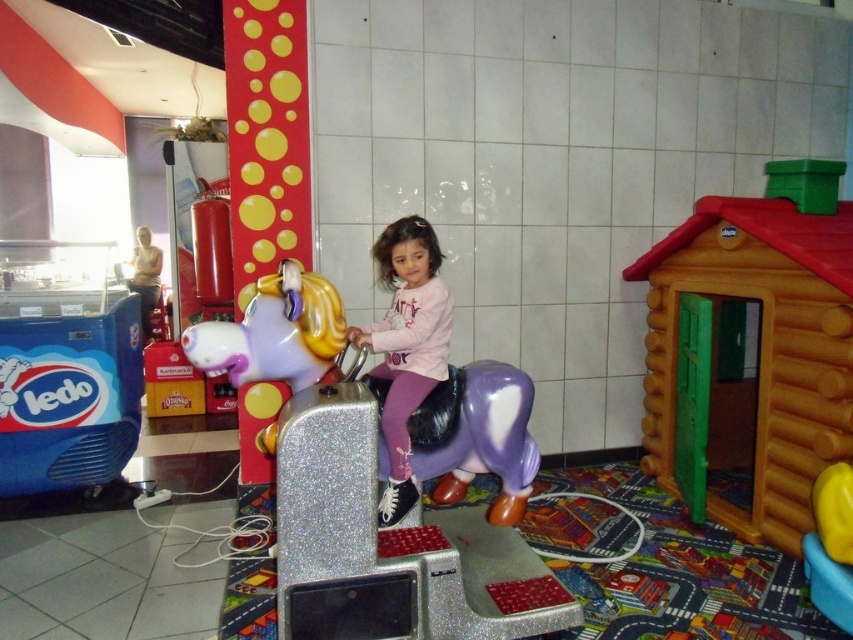
In the scene shown: You are a parent trying to choose between two attractions for your child. The shiny purple plastic horse at center and the orange plastic playhouse at right. If your child prefers taller structures, which one would you choose?

The orange plastic playhouse at right is taller than the shiny purple plastic horse at center, so you should choose the orange plastic playhouse at right.

You are standing in the play area and want to approach the shiny purple plastic horse at center. If your walking speed is 3 feet per second, how many seconds will it take you to reach the horse?

The distance between you and the shiny purple plastic horse at center is 6.18 feet. At a speed of 3 feet per second, it would take approximately 2.06 seconds to reach it.

You are a parent trying to decide between two toys for your child. You see an orange plastic playhouse at right and a pink matte unicorn at center. Which one is larger?

The orange plastic playhouse at right is bigger than the pink matte unicorn at center.